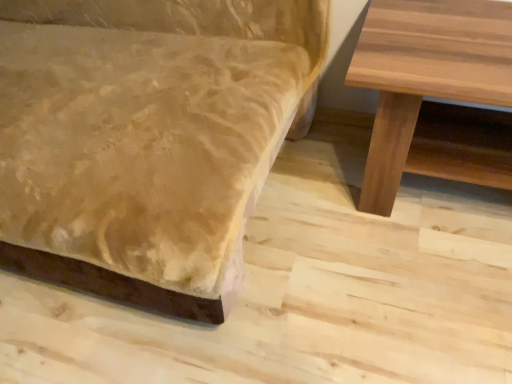
Question: Visually, is natural wood table at right positioned to the left or to the right of velvet-like beige couch at lower left?

Choices:
 (A) right
 (B) left

Answer: (A)

Question: Considering the positions of point (445, 87) and point (254, 11), is point (445, 87) closer or farther from the camera than point (254, 11)?

Choices:
 (A) farther
 (B) closer

Answer: (B)

Question: Is natural wood table at right in front of or behind velvet-like beige couch at lower left in the image?

Choices:
 (A) behind
 (B) front

Answer: (A)

Question: Considering the positions of velvet-like beige couch at lower left and natural wood table at right in the image, is velvet-like beige couch at lower left wider or thinner than natural wood table at right?

Choices:
 (A) wide
 (B) thin

Answer: (A)

Question: Is point (159, 4) positioned closer to the camera than point (507, 19)?

Choices:
 (A) closer
 (B) farther

Answer: (B)

Question: Considering the positions of velvet-like beige couch at lower left and natural wood table at right in the image, is velvet-like beige couch at lower left bigger or smaller than natural wood table at right?

Choices:
 (A) big
 (B) small

Answer: (A)

Question: Considering the relative positions of velvet-like beige couch at lower left and natural wood table at right in the image provided, is velvet-like beige couch at lower left to the left or to the right of natural wood table at right?

Choices:
 (A) right
 (B) left

Answer: (B)